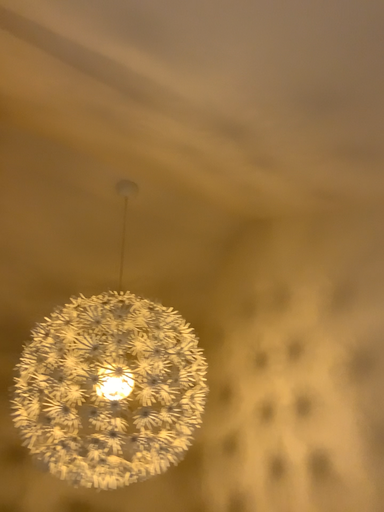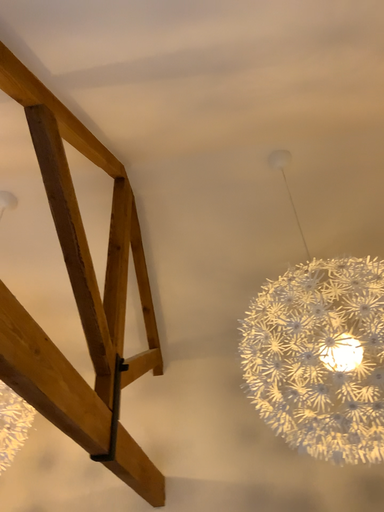
Question: How did the camera likely rotate when shooting the video?

Choices:
 (A) rotated left
 (B) rotated right

Answer: (A)